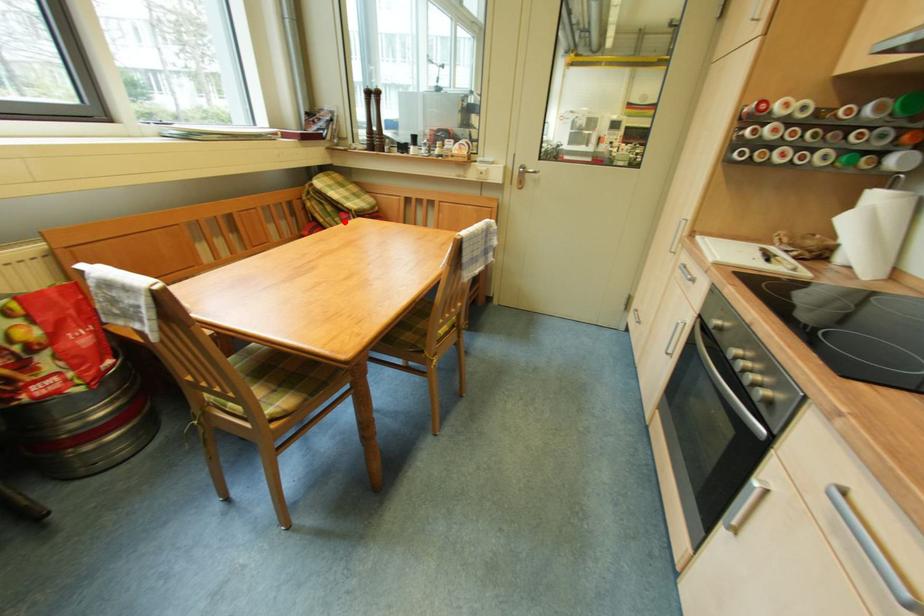
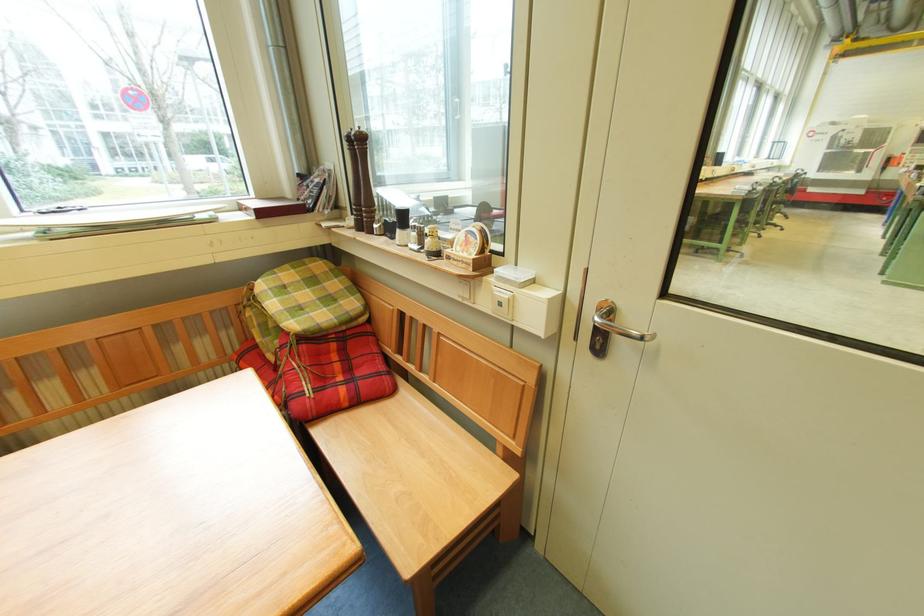
The point at the highlighted location is marked in the first image. Where is the corresponding point in the second image?

(285, 344)